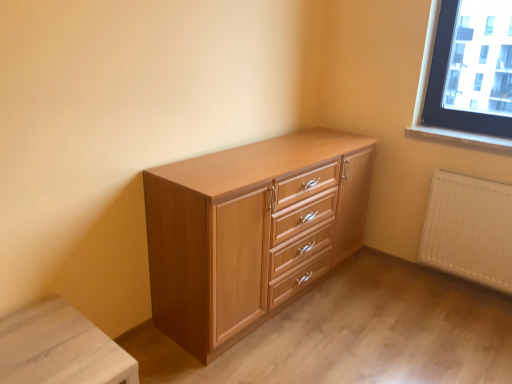
At what (x,y) coordinates should I click in order to perform the action: click on vacant region in front of light brown wood chest of drawers at center. Please return your answer as a coordinate pair (x, y). This screenshot has height=384, width=512. Looking at the image, I should click on (304, 351).